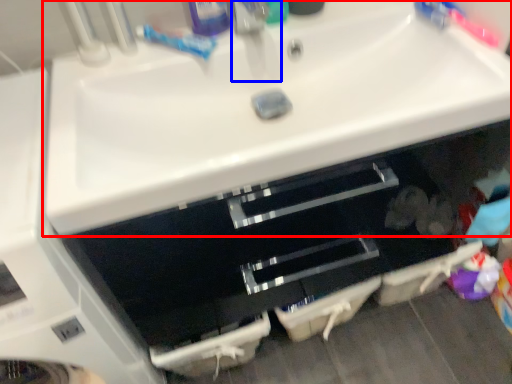
Question: Which of the following is the farthest to the observer, sink (highlighted by a red box) or faucet (highlighted by a blue box)?

Choices:
 (A) sink
 (B) faucet

Answer: (B)